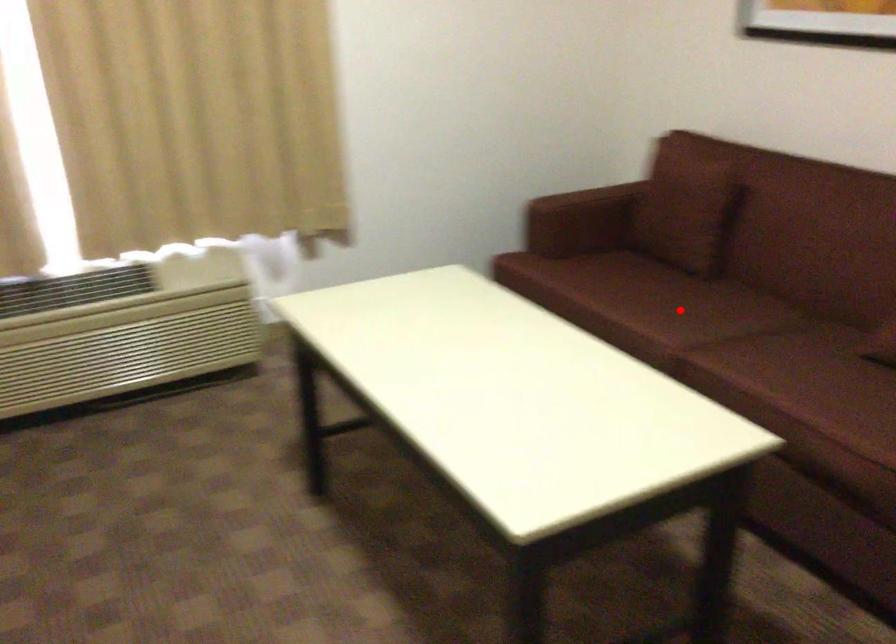
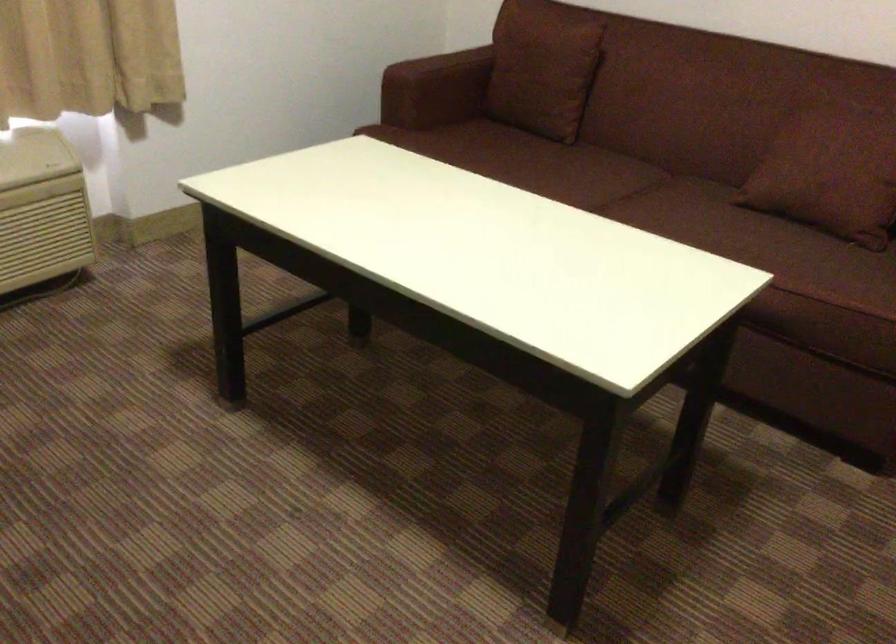
In the second image, find the point that corresponds to the highlighted location in the first image.

(574, 176)